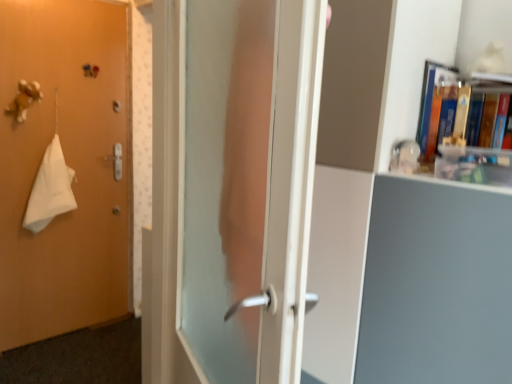
Question: Is transparent glass door at center wider or thinner than matte white bookcase at center?

Choices:
 (A) thin
 (B) wide

Answer: (A)

Question: Does point (209, 299) appear closer or farther from the camera than point (350, 240)?

Choices:
 (A) closer
 (B) farther

Answer: (A)

Question: Which object is positioned closest to the white cloth at left?

Choices:
 (A) matte orange door at left
 (B) matte white bookcase at center
 (C) hardcover book at upper right
 (D) transparent glass door at center

Answer: (A)

Question: Estimate the real-world distances between objects in this image. Which object is farther from the white cloth at left?

Choices:
 (A) matte white bookcase at center
 (B) hardcover book at upper right
 (C) matte orange door at left
 (D) transparent glass door at center

Answer: (B)